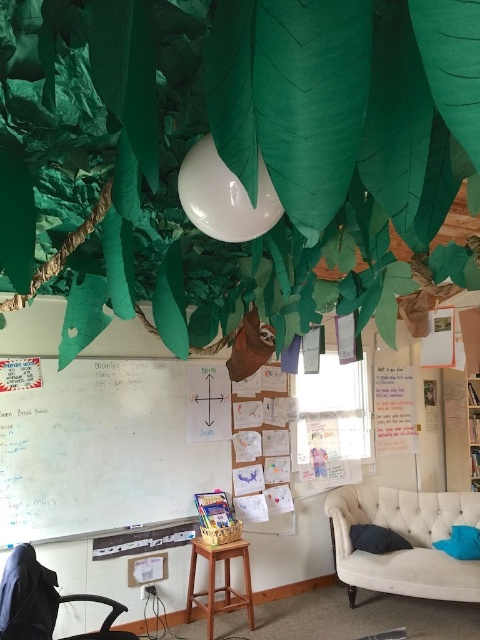
Who is shorter, black fabric armchair at lower left or blue fabric pillow at lower right?

Standing shorter between the two is blue fabric pillow at lower right.

Between point (49, 616) and point (448, 544), which one is positioned in front?

Point (49, 616) is more forward.

You are a GUI agent. You are given a task and a screenshot of the screen. Output one action in this format:
    pyautogui.click(x=<x>, y=<y>)
    Task: Click on the black fabric armchair at lower left
    This screenshot has height=640, width=480.
    Given the screenshot: What is the action you would take?
    pyautogui.click(x=43, y=602)

Can you confirm if whiteboard at left is shorter than dark blue fabric pillow at lower right?

No.

Between whiteboard at left and dark blue fabric pillow at lower right, which one is positioned lower?

dark blue fabric pillow at lower right

This screenshot has height=640, width=480. Identify the location of whiteboard at left. (101, 449).

Between whiteboard at left and blue fabric pillow at lower right, which one has more height?

whiteboard at left

Which is below, whiteboard at left or blue fabric pillow at lower right?

A: blue fabric pillow at lower right is below.

The height and width of the screenshot is (640, 480). I want to click on whiteboard at left, so click(x=101, y=449).

Image resolution: width=480 pixels, height=640 pixels. In order to click on whiteboard at left in this screenshot , I will do `click(101, 449)`.